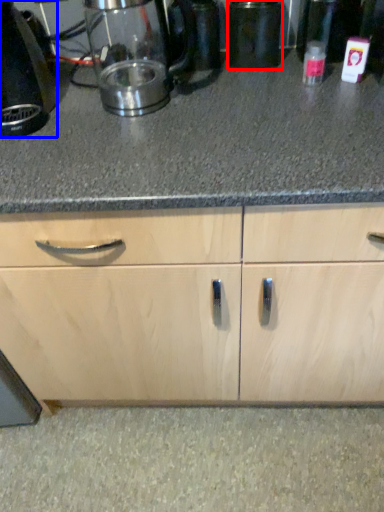
Question: Which of the following is the closest to the observer, appliance (highlighted by a red box) or home appliance (highlighted by a blue box)?

Choices:
 (A) appliance
 (B) home appliance

Answer: (B)